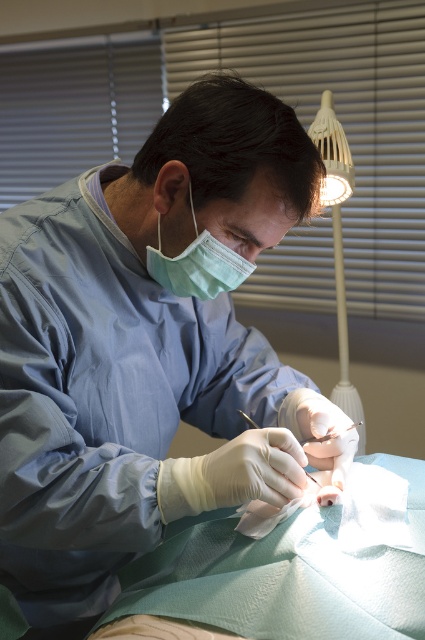
You are a medical student observing the procedure. You notice two points marked in the image. The first point is at coordinate point (x=340, y=180) and the second is at coordinate point (x=190, y=284). From your vantage point, which point is closer to you?

Point (x=190, y=284) is closer to you because it is in front of point (x=340, y=180) according to their spatial arrangement.

Based on the scene description, where is the white plastic lamp at upper right located in terms of coordinates?

The white plastic lamp at upper right is located at coordinates point (337, 241).